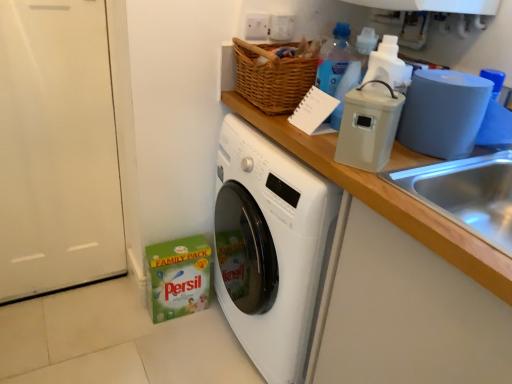
Locate an element on the screen. This screenshot has height=384, width=512. wooden at upper right is located at coordinates (387, 201).

This screenshot has height=384, width=512. What do you see at coordinates (387, 201) in the screenshot?
I see `wooden at upper right` at bounding box center [387, 201].

The image size is (512, 384). I want to click on translucent plastic bottle at upper right, positioned as the first bottle in front-to-back order, so click(334, 59).

At what (x,y) coordinates should I click in order to perform the action: click on blue translucent bottle at upper center, placed as the 1th bottle when sorted from top to bottom. Please return your answer as a coordinate pair (x, y). The image size is (512, 384). Looking at the image, I should click on (337, 45).

What do you see at coordinates (443, 113) in the screenshot? I see `blue matte toilet paper at right` at bounding box center [443, 113].

Identify the location of wooden at upper right. (387, 201).

From the image's perspective, is blue matte toilet paper at right on wooden at upper right?

Yes, from the image's perspective, blue matte toilet paper at right is over wooden at upper right.

Which of these two, blue matte toilet paper at right or wooden at upper right, stands taller?

wooden at upper right is taller.

Would you say blue matte toilet paper at right is inside or outside wooden at upper right?

blue matte toilet paper at right is outside wooden at upper right.

How many degrees apart are the facing directions of blue matte toilet paper at right and beige plastic container at upper right?

There is a 24.2-degree angle between the facing directions of blue matte toilet paper at right and beige plastic container at upper right.

At what (x,y) coordinates should I click in order to perform the action: click on appliance located on the left of blue matte toilet paper at right. Please return your answer as a coordinate pair (x, y). This screenshot has height=384, width=512. Looking at the image, I should click on (368, 126).

In the scene shown: Does blue matte toilet paper at right appear on the right side of beige plastic container at upper right?

Correct, you'll find blue matte toilet paper at right to the right of beige plastic container at upper right.

From the image's perspective, is blue matte toilet paper at right located above beige plastic container at upper right?

Yes, from the image's perspective, blue matte toilet paper at right is above beige plastic container at upper right.

Between beige plastic container at upper right and blue matte toilet paper at right, which one has larger size?

With larger size is blue matte toilet paper at right.

Considering the relative sizes of beige plastic container at upper right and blue matte toilet paper at right in the image provided, is beige plastic container at upper right shorter than blue matte toilet paper at right?

In fact, beige plastic container at upper right may be taller than blue matte toilet paper at right.

Can you tell me how much beige plastic container at upper right and blue matte toilet paper at right differ in facing direction?

beige plastic container at upper right and blue matte toilet paper at right are facing 24.2 degrees away from each other.

Considering the positions of points (341, 152) and (436, 73), is point (341, 152) closer to camera compared to point (436, 73)?

Yes, point (341, 152) is in front of point (436, 73).

From a real-world perspective, is blue matte toilet paper at right over blue translucent bottle at upper center, which is the 2th bottle in front-to-back order?

Incorrect, from a real-world perspective, blue matte toilet paper at right is lower than blue translucent bottle at upper center, which is the 2th bottle in front-to-back order.

Between blue matte toilet paper at right and blue translucent bottle at upper center, placed as the 1th bottle when sorted from top to bottom, which one has smaller size?

blue translucent bottle at upper center, placed as the 1th bottle when sorted from top to bottom, is smaller.

Looking at this image, can you confirm if blue matte toilet paper at right is shorter than blue translucent bottle at upper center, arranged as the first bottle when viewed from the back?

No, blue matte toilet paper at right is not shorter than blue translucent bottle at upper center, arranged as the first bottle when viewed from the back.

Would you say blue matte toilet paper at right is outside blue translucent bottle at upper center, arranged as the first bottle when viewed from the back?

blue matte toilet paper at right is positioned outside blue translucent bottle at upper center, arranged as the first bottle when viewed from the back.

From the image's perspective, which one is positioned higher, beige plastic container at upper right or translucent plastic bottle at upper right, the 1th bottle positioned from the bottom?

translucent plastic bottle at upper right, the 1th bottle positioned from the bottom, is shown above in the image.

What's the angular difference between beige plastic container at upper right and translucent plastic bottle at upper right, positioned as the first bottle in front-to-back order,'s facing directions?

The facing directions of beige plastic container at upper right and translucent plastic bottle at upper right, positioned as the first bottle in front-to-back order, are 58.8 degrees apart.

Relative to translucent plastic bottle at upper right, positioned as the second bottle in top-to-bottom order, is beige plastic container at upper right in front or behind?

Visually, beige plastic container at upper right is located in front of translucent plastic bottle at upper right, positioned as the second bottle in top-to-bottom order.

From a real-world perspective, is beige plastic container at upper right above or below translucent plastic bottle at upper right, positioned as the first bottle in front-to-back order?

Clearly, from a real-world perspective, beige plastic container at upper right is below translucent plastic bottle at upper right, positioned as the first bottle in front-to-back order.

Considering the relative sizes of wooden at upper right and blue matte toilet paper at right in the image provided, is wooden at upper right shorter than blue matte toilet paper at right?

No.

Considering the relative positions of wooden at upper right and blue matte toilet paper at right in the image provided, is wooden at upper right to the right of blue matte toilet paper at right from the viewer's perspective?

No, wooden at upper right is not to the right of blue matte toilet paper at right.

Does point (460, 242) come closer to viewer compared to point (446, 119)?

Yes, it is.

Which is behind, wooden at upper right or blue matte toilet paper at right?

wooden at upper right is more distant.

Consider the image. How many degrees apart are the facing directions of blue translucent bottle at upper center, arranged as the first bottle when viewed from the back, and translucent plastic bottle at upper right, positioned as the second bottle in top-to-bottom order?

They differ by 94.8 degrees in their facing directions.

Considering the positions of points (349, 51) and (344, 44), is point (349, 51) closer to camera compared to point (344, 44)?

Yes, it is.

Are blue translucent bottle at upper center, placed as the 1th bottle when sorted from top to bottom, and translucent plastic bottle at upper right, positioned as the second bottle in top-to-bottom order, located far from each other?

That's not correct — blue translucent bottle at upper center, placed as the 1th bottle when sorted from top to bottom, is a little close to translucent plastic bottle at upper right, positioned as the second bottle in top-to-bottom order.

Is blue translucent bottle at upper center, which is the 2th bottle in front-to-back order, inside or outside of translucent plastic bottle at upper right, positioned as the first bottle in front-to-back order?

blue translucent bottle at upper center, which is the 2th bottle in front-to-back order, exists outside the volume of translucent plastic bottle at upper right, positioned as the first bottle in front-to-back order.

Where is `toilet paper above the wooden at upper right (from the image's perspective)`? The image size is (512, 384). toilet paper above the wooden at upper right (from the image's perspective) is located at coordinates (443, 113).

Locate an element on the screen. appliance located above the blue matte toilet paper at right (from a real-world perspective) is located at coordinates (368, 126).

When comparing their distances from beige plastic container at upper right, does blue translucent bottle at upper center, which is the 2th bottle in front-to-back order, or wooden at upper right seem further?

blue translucent bottle at upper center, which is the 2th bottle in front-to-back order, lies further to beige plastic container at upper right than the other object.

Looking at this image, estimate the real-world distances between objects in this image. Which object is closer to wooden at upper right, beige plastic container at upper right or translucent plastic bottle at upper right, the 2th bottle in the back-to-front sequence?

The object closer to wooden at upper right is beige plastic container at upper right.

Which object lies nearer to the anchor point blue translucent bottle at upper center, which appears as the second bottle when ordered from the bottom, wooden at upper right or beige plastic container at upper right?

beige plastic container at upper right.

Which object lies nearer to the anchor point wooden at upper right, blue translucent bottle at upper center, which appears as the second bottle when ordered from the bottom, or blue matte toilet paper at right?

blue matte toilet paper at right is closer to wooden at upper right.

Looking at the image, which one is located further to translucent plastic bottle at upper right, the 2th bottle in the back-to-front sequence, blue translucent bottle at upper center, which is the 2th bottle in front-to-back order, or blue matte toilet paper at right?

The object further to translucent plastic bottle at upper right, the 2th bottle in the back-to-front sequence, is blue matte toilet paper at right.

Estimate the real-world distances between objects in this image. Which object is further from blue translucent bottle at upper center, which appears as the second bottle when ordered from the bottom, beige plastic container at upper right or blue matte toilet paper at right?

Among the two, beige plastic container at upper right is located further to blue translucent bottle at upper center, which appears as the second bottle when ordered from the bottom.

From the image, which object appears to be nearer to translucent plastic bottle at upper right, the 2th bottle in the back-to-front sequence, blue matte toilet paper at right or beige plastic container at upper right?

Based on the image, beige plastic container at upper right appears to be nearer to translucent plastic bottle at upper right, the 2th bottle in the back-to-front sequence.

Which object lies nearer to the anchor point translucent plastic bottle at upper right, positioned as the second bottle in top-to-bottom order, blue matte toilet paper at right or blue translucent bottle at upper center, which is the 2th bottle in front-to-back order?

blue translucent bottle at upper center, which is the 2th bottle in front-to-back order, lies closer to translucent plastic bottle at upper right, positioned as the second bottle in top-to-bottom order, than the other object.

The image size is (512, 384). Identify the location of appliance between translucent plastic bottle at upper right, positioned as the second bottle in top-to-bottom order, and blue matte toilet paper at right from left to right. (368, 126).

Image resolution: width=512 pixels, height=384 pixels. What are the coordinates of `bottle between blue translucent bottle at upper center, which is the 2th bottle in front-to-back order, and wooden at upper right, in the vertical direction` in the screenshot? It's located at (334, 59).

Where is `appliance between translucent plastic bottle at upper right, positioned as the first bottle in front-to-back order, and wooden at upper right, in the vertical direction`? The image size is (512, 384). appliance between translucent plastic bottle at upper right, positioned as the first bottle in front-to-back order, and wooden at upper right, in the vertical direction is located at coordinates (368, 126).

The width and height of the screenshot is (512, 384). What are the coordinates of `bottle between blue matte toilet paper at right and blue translucent bottle at upper center, which is the 2th bottle in front-to-back order, from front to back` in the screenshot? It's located at (334, 59).